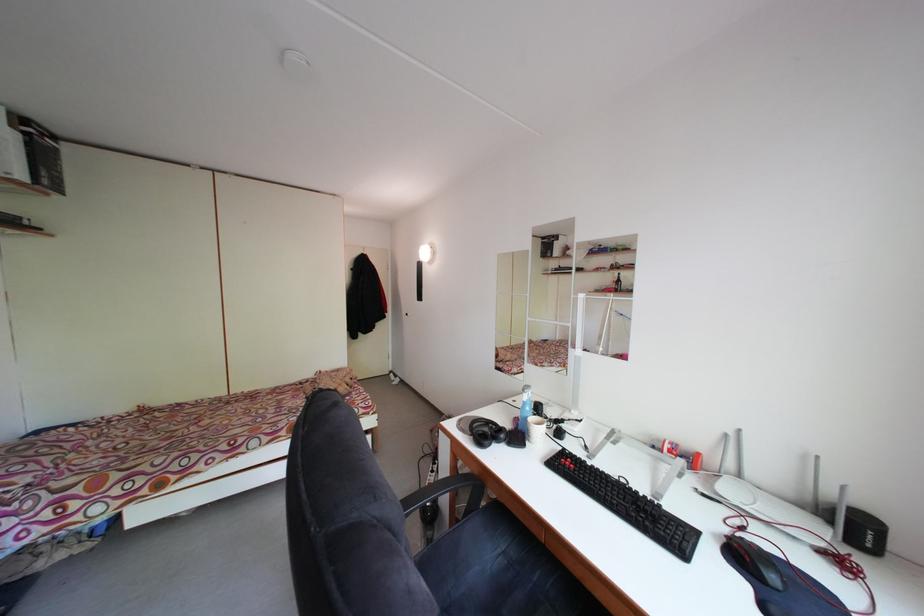
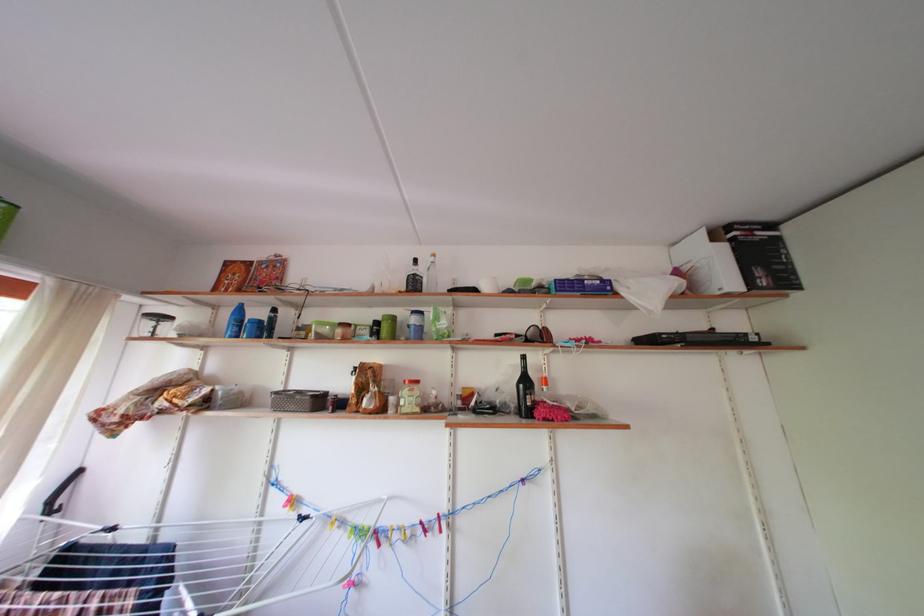
Locate, in the second image, the point that corresponds to point 53,180 in the first image.

(768, 278)